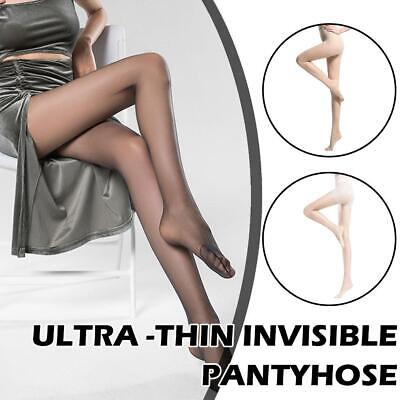
The height and width of the screenshot is (400, 400). Find the location of `white chair`. white chair is located at coordinates (116, 46).